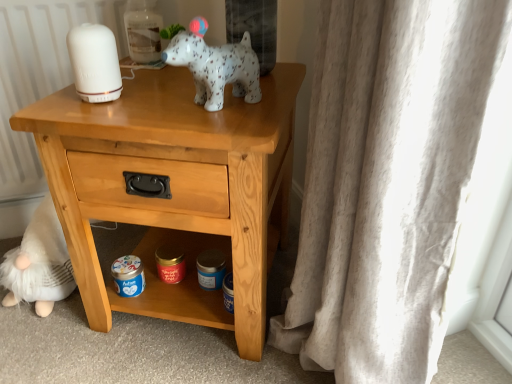
This screenshot has width=512, height=384. What are the coordinates of `free space in front of white matte bottle at upper center` in the screenshot? It's located at point(148,69).